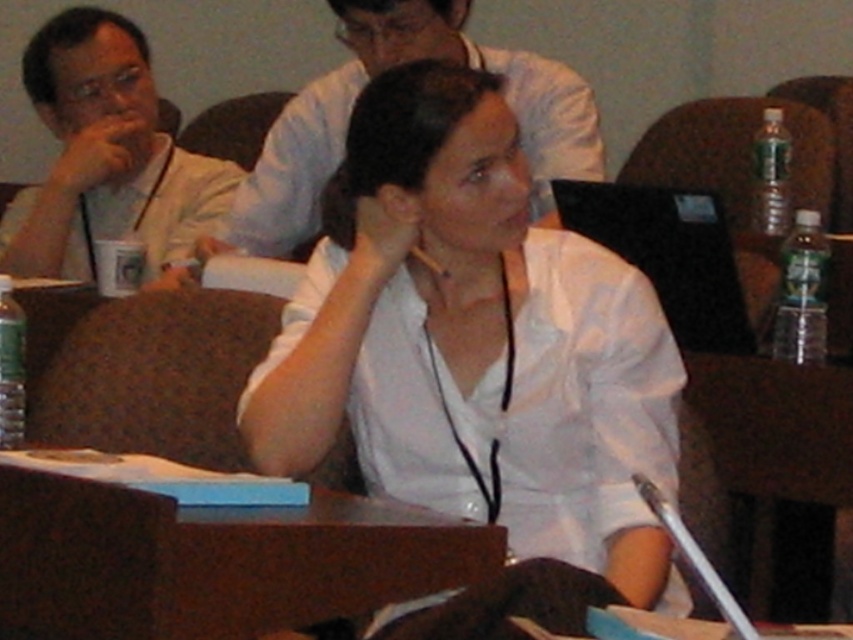
You are a person who needs to place a 16 inch wide box on the brown wood table at lower center. Can you determine if the white matte shirt at center will interfere with placing the box?

The white matte shirt at center is 15.70 inches from the brown wood table at lower center, which is closer than the 16 inch wide box. This means placing the box might cause interference as the shirt is too close to the table.

You are organizing a photo shoot and need to arrange the lighting so that both the matte white shirt at left and the white shirt at upper center are well illuminated. Considering their positions, which shirt should you focus the light on first to ensure both are properly lit?

The white shirt at upper center is behind the matte white shirt at left, so you should focus the light on the matte white shirt at left first. This way, the light can reach both shirts without the foreground shirt casting a shadow on the one behind.

You are organizing a photo shoot and need to arrange two shirts for a display. The white matte shirt at center and the matte white shirt at left are both available. Which shirt should you choose if you want the larger one for the main display?

The matte white shirt at left is larger in size compared to the white matte shirt at center, so you should choose the matte white shirt at left for the main display.